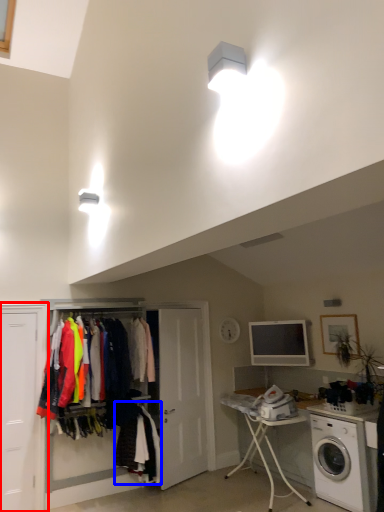
Question: Which of the following is the farthest to the observer, door (highlighted by a red box) or clothing (highlighted by a blue box)?

Choices:
 (A) door
 (B) clothing

Answer: (B)